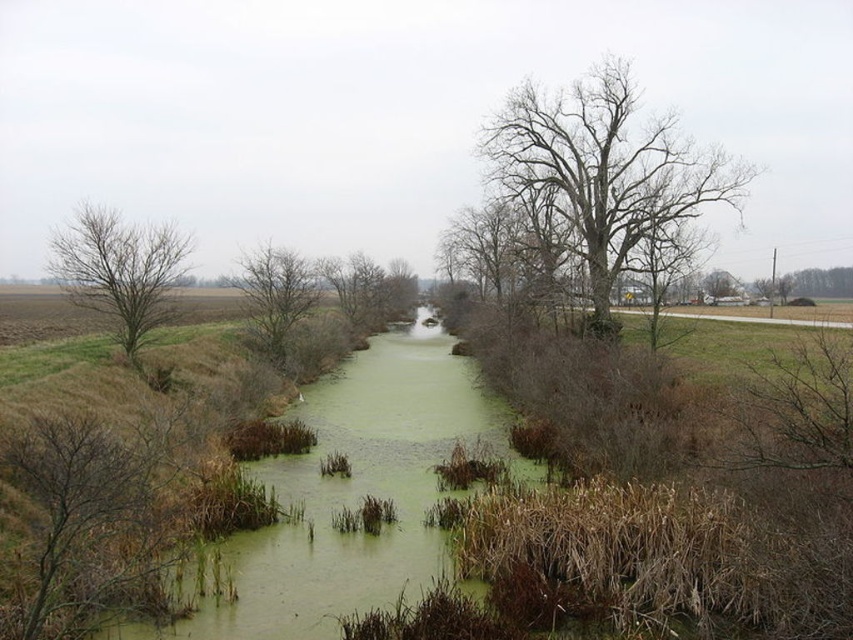
Question: In this image, where is bare branches at center located relative to brown leafless tree at center?

Choices:
 (A) below
 (B) above

Answer: (A)

Question: Can you confirm if bare branches tree at upper center is positioned to the right of brown leafless tree at center?

Choices:
 (A) yes
 (B) no

Answer: (A)

Question: Based on their relative distances, which object is nearer to the bare branches tree at upper center?

Choices:
 (A) brown leafless tree at center
 (B) green algae-covered water at center

Answer: (B)

Question: Which object is closer to the camera taking this photo?

Choices:
 (A) green algae-covered water at center
 (B) bare branches at left
 (C) brown dry branches at left

Answer: (C)

Question: Estimate the real-world distances between objects in this image. Which object is farther from the bare branches at left?

Choices:
 (A) bare branches tree at upper center
 (B) bare branches at center
 (C) brown leafless tree at center
 (D) brown dry branches at left

Answer: (C)

Question: Can you confirm if bare branches at center is positioned below brown leafless tree at center?

Choices:
 (A) yes
 (B) no

Answer: (A)